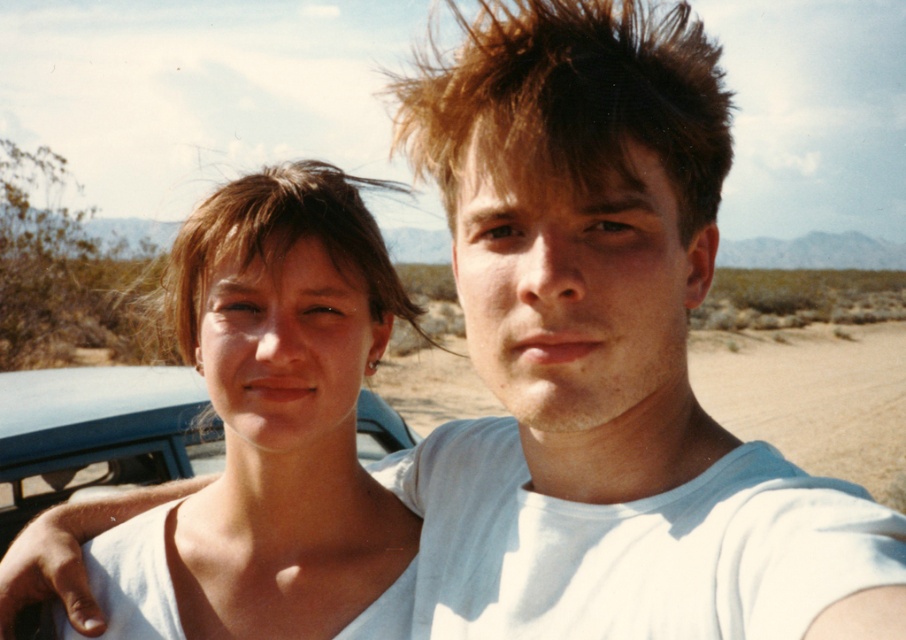
From the picture: Does matte white tank top at center appear on the right side of brown spiky hair at upper right?

Incorrect, matte white tank top at center is not on the right side of brown spiky hair at upper right.

Who is higher up, matte white tank top at center or brown spiky hair at upper right?

brown spiky hair at upper right is higher up.

Which is in front, point (178, 243) or point (658, 141)?

Point (658, 141) is in front.

Find the location of a particular element. The height and width of the screenshot is (640, 906). matte white tank top at center is located at coordinates (276, 417).